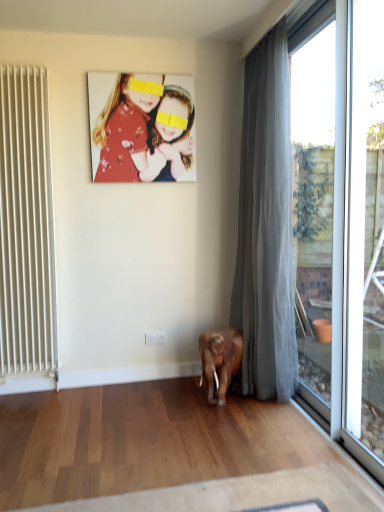
Locate an element on the screen. The width and height of the screenshot is (384, 512). vacant space situated above floral fabric photo at upper center (from a real-world perspective) is located at coordinates (138, 74).